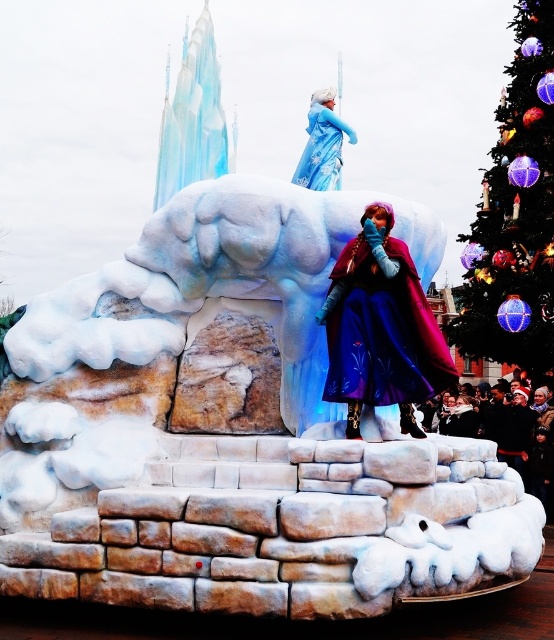
Can you confirm if purple satin dress at center is positioned to the left of matte blue dress at center?

In fact, purple satin dress at center is to the right of matte blue dress at center.

Which is behind, point (347, 428) or point (325, 99)?

Positioned behind is point (325, 99).

Is point (381, 371) positioned after point (334, 179)?

No, it is not.

In order to click on purple satin dress at center in this screenshot , I will do `click(381, 328)`.

Who is lower down, iridescent glass ornaments at upper right or purple satin dress at center?

Positioned lower is purple satin dress at center.

Does iridescent glass ornaments at upper right have a lesser width compared to purple satin dress at center?

Incorrect, iridescent glass ornaments at upper right's width is not less than purple satin dress at center's.

Which is in front, point (504, 257) or point (368, 237)?

Point (368, 237) is more forward.

You are a GUI agent. You are given a task and a screenshot of the screen. Output one action in this format:
    pyautogui.click(x=<x>, y=<y>)
    Task: Click on the iridescent glass ornaments at upper right
    This screenshot has height=640, width=554.
    Given the screenshot: What is the action you would take?
    pyautogui.click(x=515, y=212)

Between iridescent glass ornaments at upper right and velvet purple cape at center, which one appears on the right side from the viewer's perspective?

Positioned to the right is iridescent glass ornaments at upper right.

Is iridescent glass ornaments at upper right positioned at the back of velvet purple cape at center?

Yes.

Does point (520, 22) come behind point (530, 419)?

Yes, it is behind point (530, 419).

The height and width of the screenshot is (640, 554). I want to click on iridescent glass ornaments at upper right, so click(515, 212).